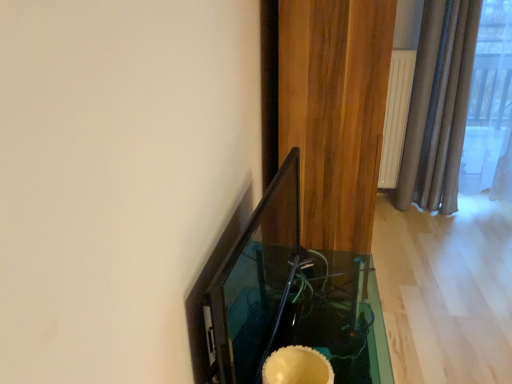
Question: Is brown wood curtain at right at the right side of transparent glass table at center?

Choices:
 (A) yes
 (B) no

Answer: (A)

Question: Does brown wood curtain at right have a greater width compared to transparent glass table at center?

Choices:
 (A) yes
 (B) no

Answer: (A)

Question: From the image's perspective, is brown wood curtain at right located beneath transparent glass table at center?

Choices:
 (A) no
 (B) yes

Answer: (A)

Question: Are brown wood curtain at right and transparent glass table at center making contact?

Choices:
 (A) no
 (B) yes

Answer: (A)

Question: Does brown wood curtain at right have a lesser height compared to transparent glass table at center?

Choices:
 (A) no
 (B) yes

Answer: (A)

Question: From a real-world perspective, is brown wood curtain at right located higher than transparent glass table at center?

Choices:
 (A) yes
 (B) no

Answer: (A)

Question: Could you tell me if transparent glass table at center is turned towards brown wood curtain at right?

Choices:
 (A) no
 (B) yes

Answer: (A)

Question: Are transparent glass table at center and brown wood curtain at right beside each other?

Choices:
 (A) no
 (B) yes

Answer: (A)

Question: Is brown wood curtain at right surrounded by transparent glass table at center?

Choices:
 (A) no
 (B) yes

Answer: (A)

Question: Considering the relative sizes of transparent glass table at center and brown wood curtain at right in the image provided, is transparent glass table at center taller than brown wood curtain at right?

Choices:
 (A) yes
 (B) no

Answer: (B)

Question: Does transparent glass table at center have a larger size compared to brown wood curtain at right?

Choices:
 (A) no
 (B) yes

Answer: (A)

Question: Can you confirm if transparent glass table at center is wider than brown wood curtain at right?

Choices:
 (A) no
 (B) yes

Answer: (A)

Question: Considering the positions of transparent glass table at center and brown wood curtain at right in the image, is transparent glass table at center bigger or smaller than brown wood curtain at right?

Choices:
 (A) small
 (B) big

Answer: (A)